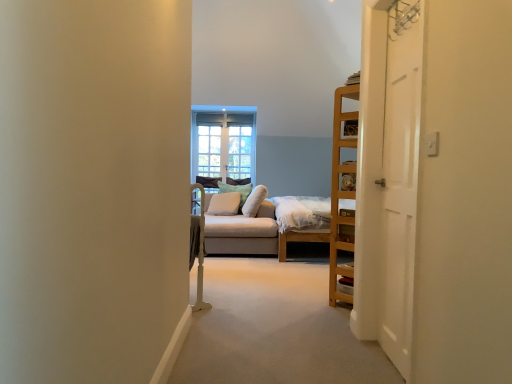
Question: Does light green textured pillow at center, the third pillow positioned from the right, have a smaller size compared to white wooden door at right?

Choices:
 (A) yes
 (B) no

Answer: (B)

Question: Is light green textured pillow at center, the third pillow positioned from the right, with white wooden door at right?

Choices:
 (A) yes
 (B) no

Answer: (B)

Question: Is light green textured pillow at center, the third pillow positioned from the right, completely or partially outside of white wooden door at right?

Choices:
 (A) yes
 (B) no

Answer: (A)

Question: From the image's perspective, is light green textured pillow at center, which is counted as the first pillow, starting from the left, on top of white wooden door at right?

Choices:
 (A) no
 (B) yes

Answer: (A)

Question: From a real-world perspective, is light green textured pillow at center, the third pillow positioned from the right, located beneath white wooden door at right?

Choices:
 (A) yes
 (B) no

Answer: (A)

Question: From the image's perspective, is green fabric pillow at center, arranged as the 2th pillow when viewed from the left, positioned above or below light gray fabric studio couch at center?

Choices:
 (A) above
 (B) below

Answer: (A)

Question: Choose the correct answer: Is green fabric pillow at center, placed as the second pillow when sorted from right to left, inside light gray fabric studio couch at center or outside it?

Choices:
 (A) outside
 (B) inside

Answer: (B)

Question: Considering the positions of green fabric pillow at center, arranged as the 2th pillow when viewed from the left, and light gray fabric studio couch at center in the image, is green fabric pillow at center, arranged as the 2th pillow when viewed from the left, taller or shorter than light gray fabric studio couch at center?

Choices:
 (A) tall
 (B) short

Answer: (B)

Question: Is point (227, 188) positioned closer to the camera than point (252, 241)?

Choices:
 (A) farther
 (B) closer

Answer: (A)

Question: In the image, is light brown wooden bed at center positioned in front of or behind clear glass window at center?

Choices:
 (A) front
 (B) behind

Answer: (A)

Question: Does point (305, 226) appear closer or farther from the camera than point (224, 155)?

Choices:
 (A) farther
 (B) closer

Answer: (B)

Question: Considering the relative positions of light brown wooden bed at center and clear glass window at center in the image provided, is light brown wooden bed at center to the left or to the right of clear glass window at center?

Choices:
 (A) right
 (B) left

Answer: (A)

Question: Is light brown wooden bed at center inside the boundaries of clear glass window at center, or outside?

Choices:
 (A) inside
 (B) outside

Answer: (B)

Question: Is clear glass window at center in front of or behind light gray fabric studio couch at center in the image?

Choices:
 (A) behind
 (B) front

Answer: (A)

Question: Based on their positions, is clear glass window at center located to the left or right of light gray fabric studio couch at center?

Choices:
 (A) left
 (B) right

Answer: (A)